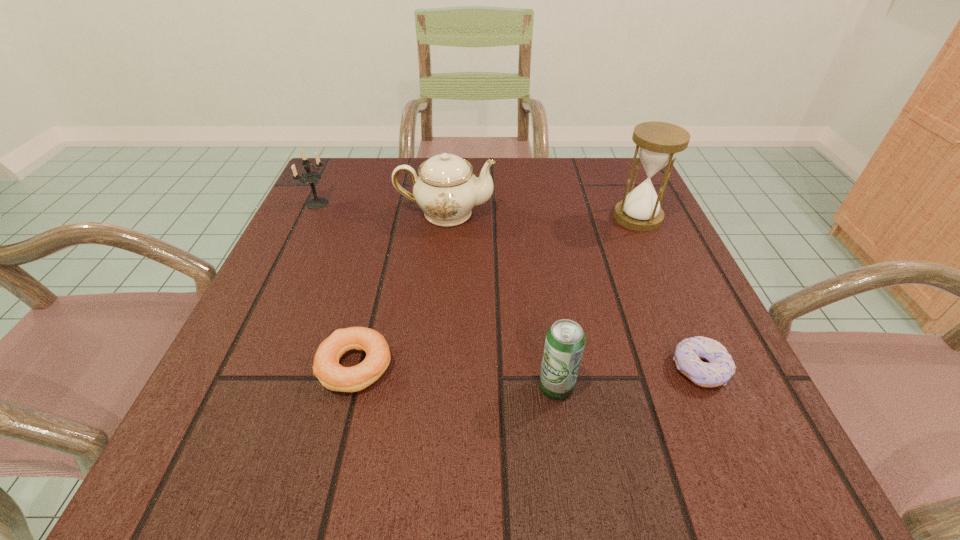
Where is `object that is at the far right corner`? This screenshot has height=540, width=960. object that is at the far right corner is located at coordinates (657, 143).

Where is `vacant space at the far edge of the desktop`? vacant space at the far edge of the desktop is located at coordinates [543, 182].

Where is `vacant position at the near edge of the desktop`? The width and height of the screenshot is (960, 540). vacant position at the near edge of the desktop is located at coordinates (487, 424).

In the image, there is a desktop. In order to click on vacant space at the left edge in this screenshot , I will do `click(303, 286)`.

What are the coordinates of `free space at the right edge of the desktop` in the screenshot? It's located at (665, 373).

I want to click on vacant space at the far left corner, so click(x=369, y=160).

What are the coordinates of `free region at the near left corner of the desktop` in the screenshot? It's located at (240, 424).

You are a GUI agent. You are given a task and a screenshot of the screen. Output one action in this format:
    pyautogui.click(x=<x>, y=<y>)
    Task: Click on the free space between the doughnut and the hourglass
    Image resolution: width=960 pixels, height=540 pixels.
    Given the screenshot: What is the action you would take?
    pyautogui.click(x=668, y=293)

I want to click on free space between the bagel and the chinaware, so click(400, 289).

You are a GUI agent. You are given a task and a screenshot of the screen. Output one action in this format:
    pyautogui.click(x=<x>, y=<y>)
    Task: Click on the free space between the leftmost object and the tallest object
    This screenshot has width=960, height=540.
    Given the screenshot: What is the action you would take?
    click(x=478, y=210)